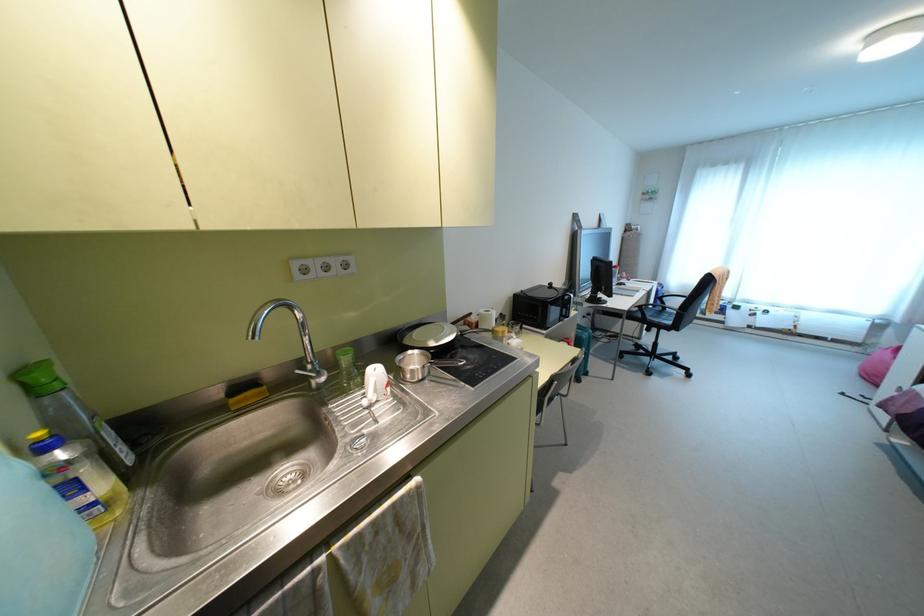
The image size is (924, 616). What do you see at coordinates (312, 374) in the screenshot?
I see `a silver faucet handle` at bounding box center [312, 374].